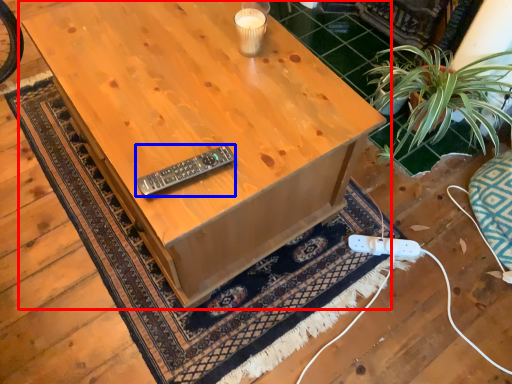
Question: Among these objects, which one is nearest to the camera, table (highlighted by a red box) or control (highlighted by a blue box)?

Choices:
 (A) table
 (B) control

Answer: (A)